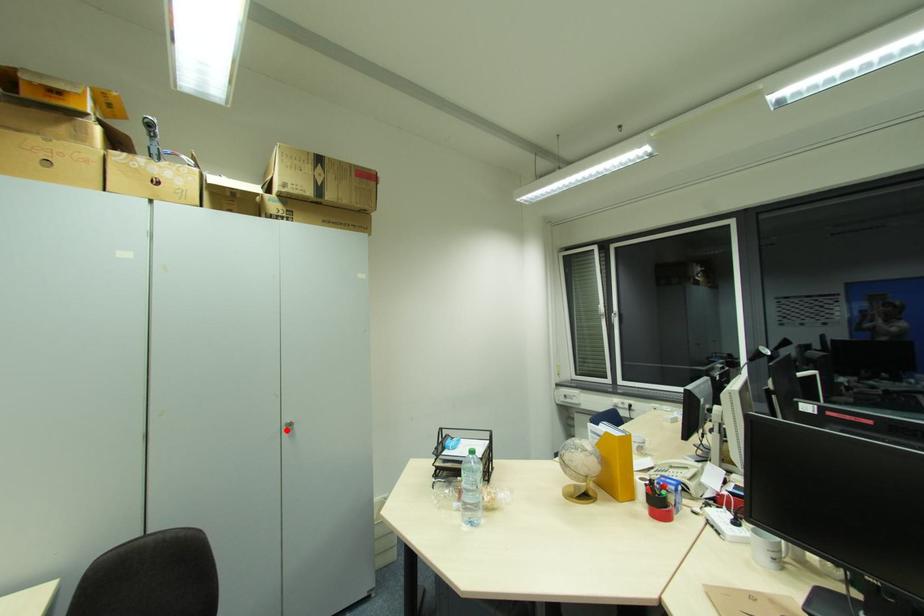
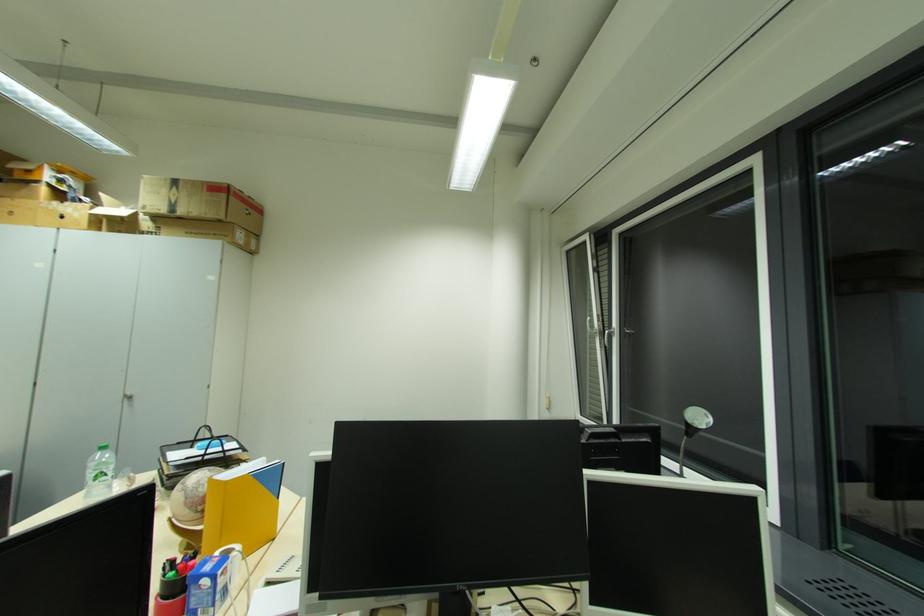
Find the pixel in the second image that matches the highlighted location in the first image.

(128, 400)